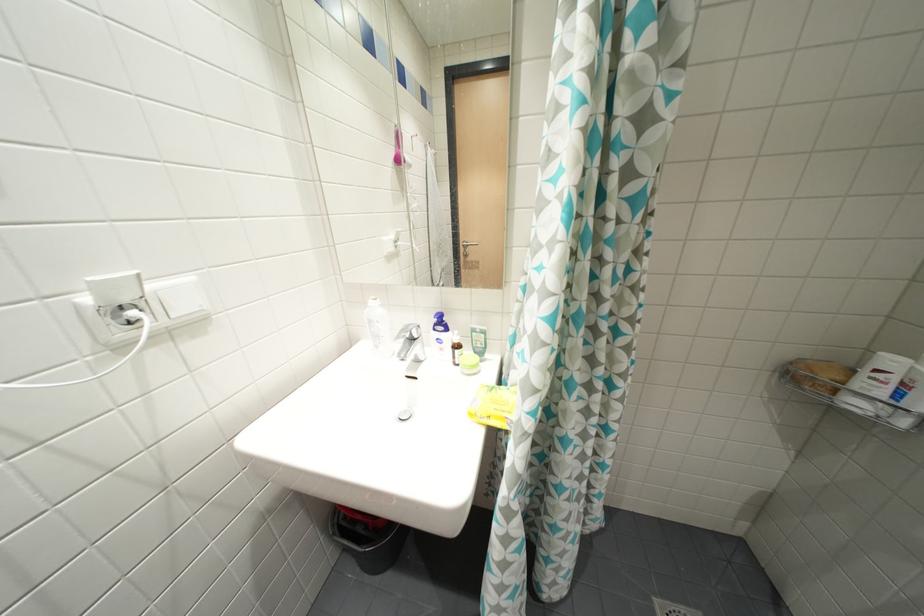
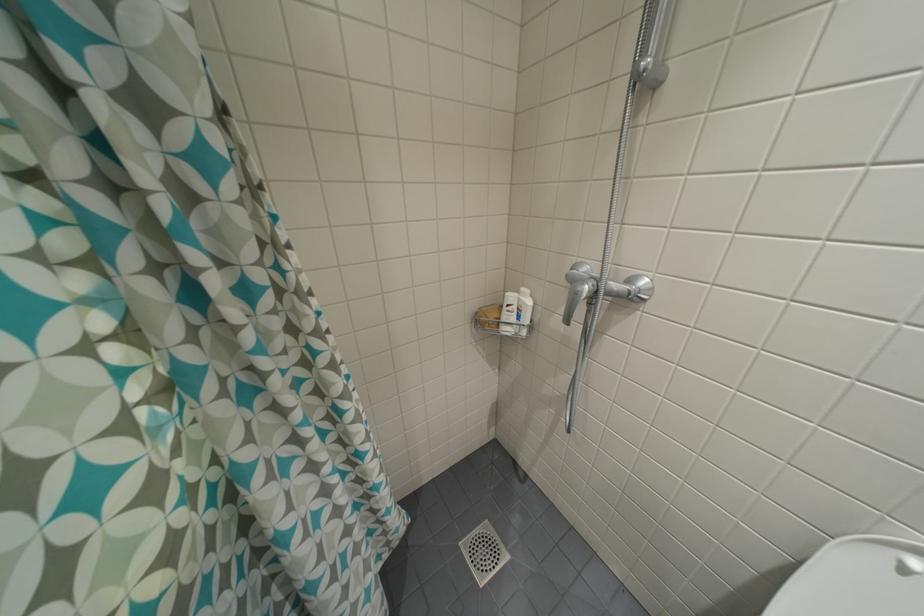
Question: The camera is either moving clockwise (left) or counter-clockwise (right) around the object. The first image is from the beginning of the video and the second image is from the end. Is the camera moving left or right when shooting the video?

Choices:
 (A) Left
 (B) Right

Answer: (A)